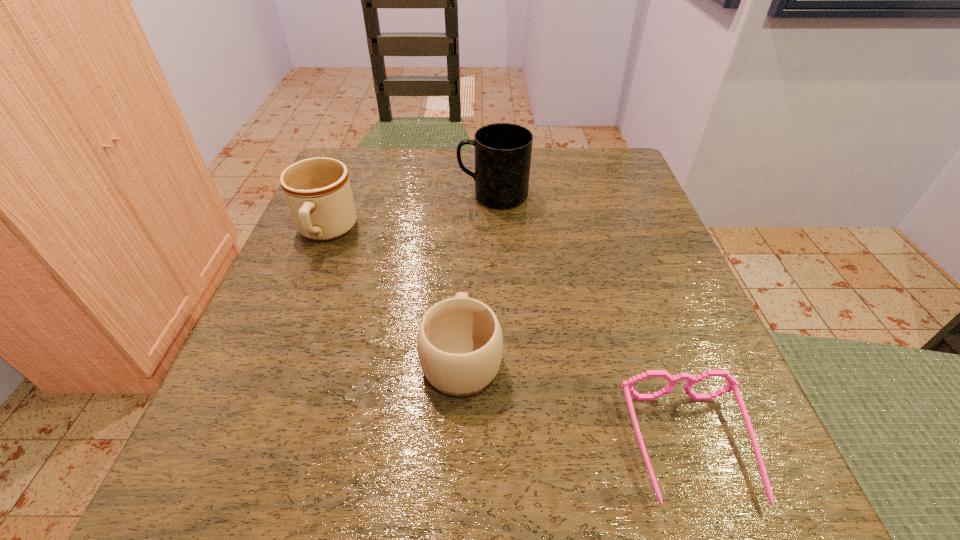
Select which mug is the closest to the leftmost object. Please provide its 2D coordinates. Your answer should be formatted as a tuple, i.e. [(x, y)], where the tuple contains the x and y coordinates of a point satisfying the conditions above.

[(503, 151)]

Select which mug is the second closest to the shortest mug. Please provide its 2D coordinates. Your answer should be formatted as a tuple, i.e. [(x, y)], where the tuple contains the x and y coordinates of a point satisfying the conditions above.

[(503, 151)]